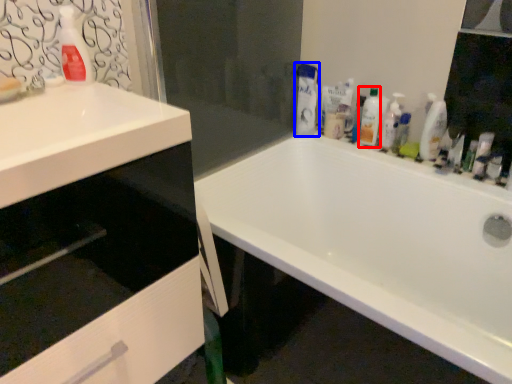
Question: Among these objects, which one is nearest to the camera, cleaning product (highlighted by a red box) or cleaning product (highlighted by a blue box)?

Choices:
 (A) cleaning product
 (B) cleaning product

Answer: (A)